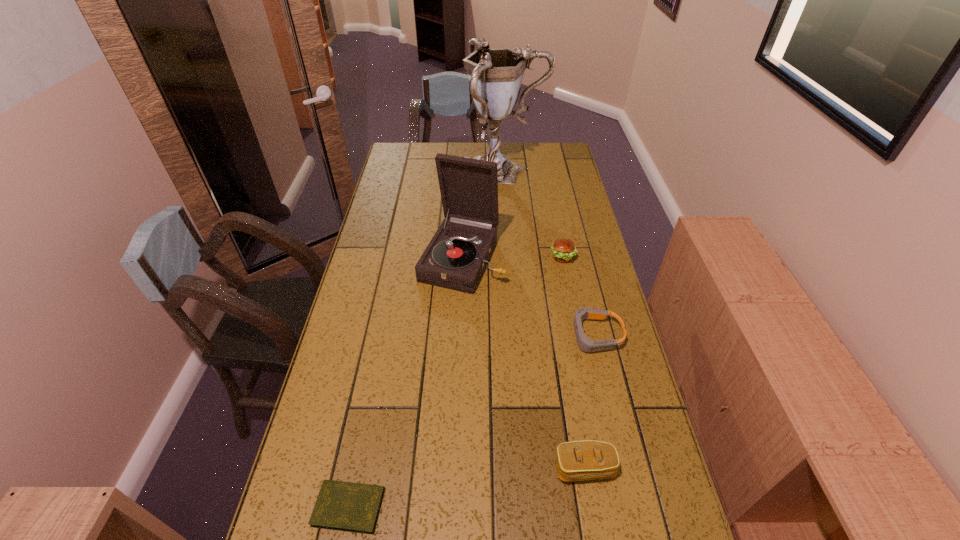
The width and height of the screenshot is (960, 540). What are the coordinates of `clutch bag present at the right edge` in the screenshot? It's located at (578, 460).

This screenshot has height=540, width=960. I want to click on goggles that is at the right edge, so click(x=585, y=344).

Find the location of `object that is at the far right corner`. object that is at the far right corner is located at coordinates (495, 75).

This screenshot has height=540, width=960. In the image, there is a desktop. Find the location of `vacant region at the far edge`. vacant region at the far edge is located at coordinates (471, 150).

The height and width of the screenshot is (540, 960). In the image, there is a desktop. What are the coordinates of `vacant space at the left edge` in the screenshot? It's located at (347, 442).

Image resolution: width=960 pixels, height=540 pixels. I want to click on vacant space at the right edge of the desktop, so click(640, 423).

Identify the location of vacant area that lies between the leftmost object and the phonograph record. The image size is (960, 540). (405, 383).

Locate an element on the screen. This screenshot has width=960, height=540. empty space that is in between the clutch bag and the shortest object is located at coordinates (467, 488).

Identify the location of free space that is in between the clutch bag and the shortest object. This screenshot has height=540, width=960. (467, 488).

Locate an element on the screen. The height and width of the screenshot is (540, 960). vacant area that lies between the hamburger and the clutch bag is located at coordinates (574, 363).